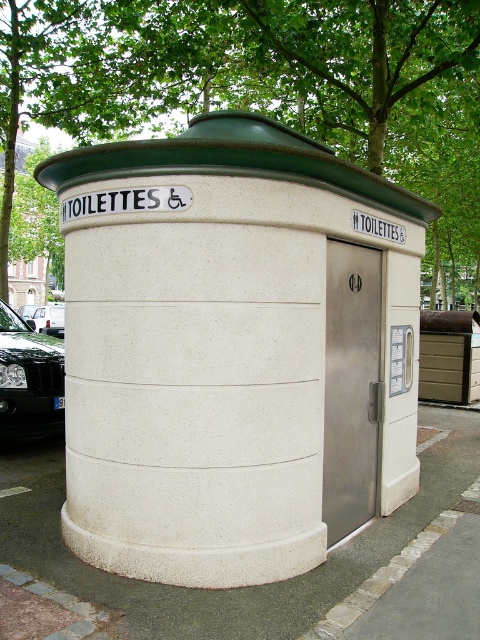
Does white concrete toilettes at center appear on the left side of white concrete pavement at lower center?

In fact, white concrete toilettes at center is to the right of white concrete pavement at lower center.

Is white concrete toilettes at center closer to the viewer compared to white concrete pavement at lower center?

That is True.

Is point (264, 305) more distant than point (408, 534)?

No, it is in front of (408, 534).

Find the location of a particular element. white concrete toilettes at center is located at coordinates (228, 349).

Based on the photo, is white concrete pavement at lower center closer to the viewer compared to shiny black car at left?

Yes.

Between white concrete pavement at lower center and shiny black car at left, which one is positioned lower?

Positioned lower is white concrete pavement at lower center.

I want to click on white concrete pavement at lower center, so click(229, 588).

This screenshot has width=480, height=640. I want to click on white concrete toilettes at center, so click(228, 349).

Between point (131, 298) and point (54, 344), which one is positioned behind?

Positioned behind is point (54, 344).

Is point (395, 300) farther from camera compared to point (25, 396)?

No, it is not.

Locate an element on the screen. This screenshot has width=480, height=640. white concrete toilettes at center is located at coordinates (228, 349).